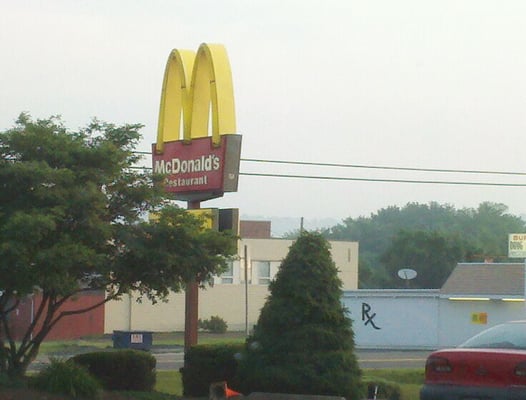
Where is `wall`? The image size is (526, 400). wall is located at coordinates (220, 308).